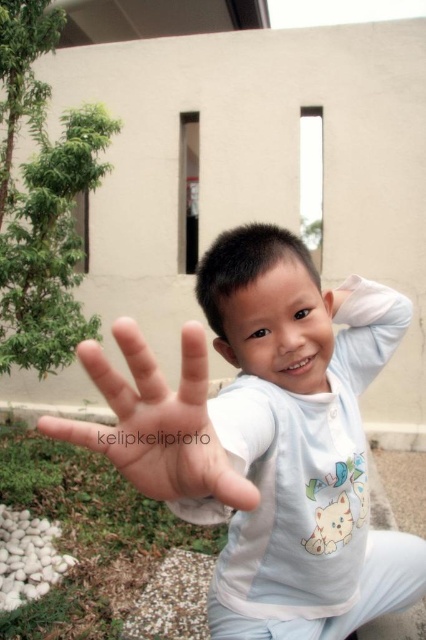
Question: Does white cotton shirt at center have a greater width compared to smooth skin hand at center?

Choices:
 (A) yes
 (B) no

Answer: (A)

Question: Which point is closer to the camera taking this photo?

Choices:
 (A) (196, 458)
 (B) (344, 636)

Answer: (A)

Question: Is white cotton shirt at center positioned before smooth skin hand at center?

Choices:
 (A) yes
 (B) no

Answer: (B)

Question: Does white cotton shirt at center appear on the right side of smooth skin hand at center?

Choices:
 (A) yes
 (B) no

Answer: (A)

Question: Among these objects, which one is farthest from the camera?

Choices:
 (A) smooth skin hand at center
 (B) white cotton shirt at center

Answer: (B)

Question: Among these points, which one is nearest to the camera?

Choices:
 (A) (134, 436)
 (B) (362, 472)

Answer: (A)